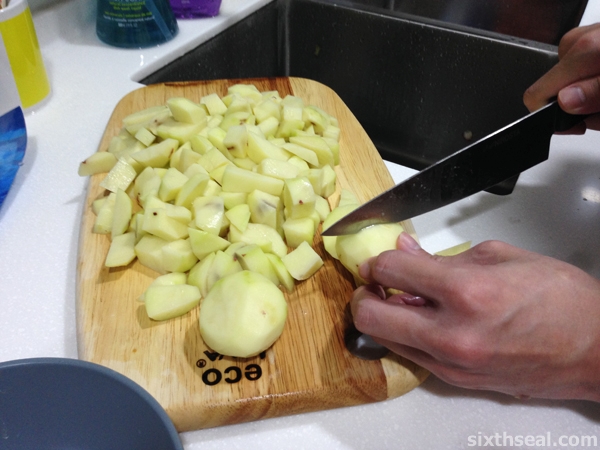
Where is `wooden kitchen cutting board`? wooden kitchen cutting board is located at coordinates (316, 381).